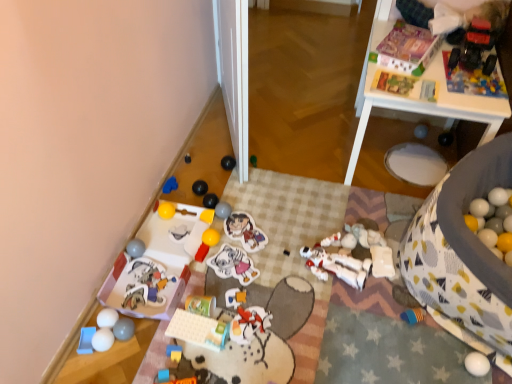
The width and height of the screenshot is (512, 384). In order to click on free space in front of yellow rubber ball at center, the 16th toy positioned from the left in this screenshot , I will do `click(211, 278)`.